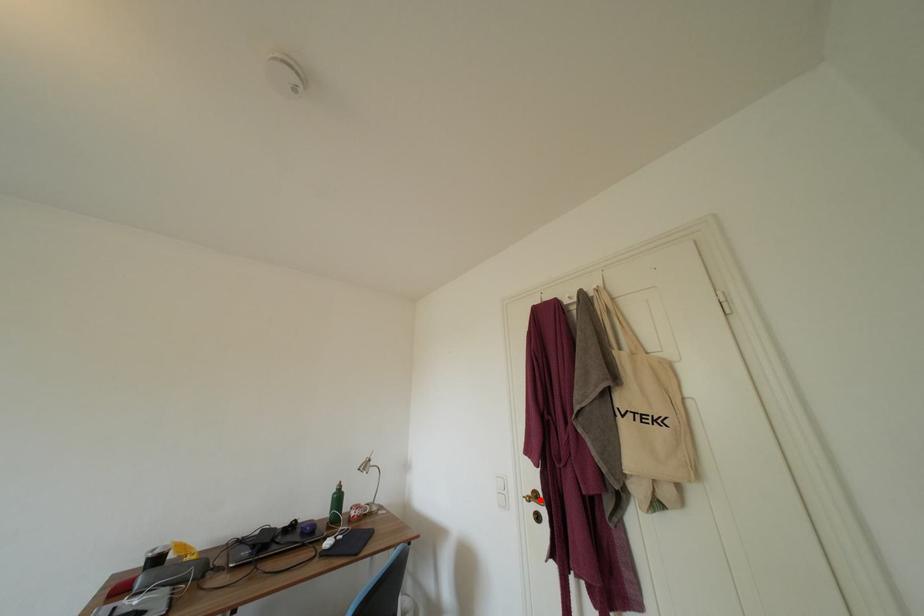
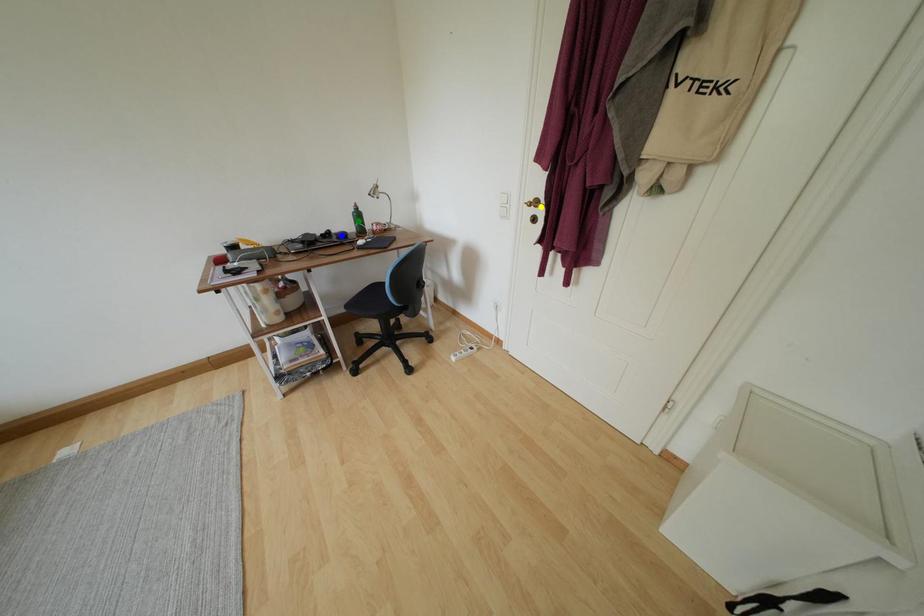
Question: I am providing you with two images of the same scene from different viewpoints. A red point is marked on the first image. You are given multiple points on the second image. Which mark in image 2 goes with the point in image 1?

Choices:
 (A) yellow point
 (B) green point
 (C) blue point

Answer: (A)